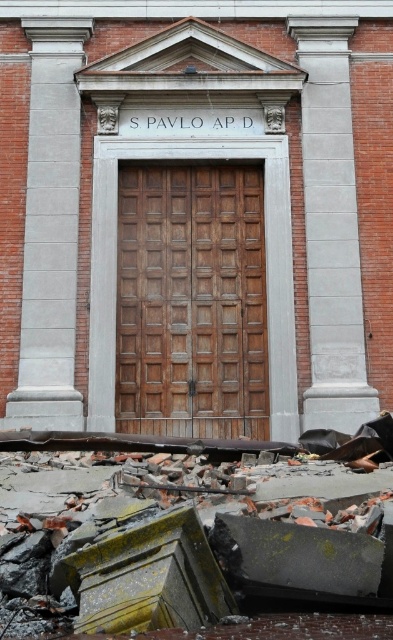
You are a delivery person trying to enter the building through the wooden panelled door at center. There is a gray concrete column at right nearby. Based on the scene, can you tell me whether the door is positioned lower than the column?

The wooden panelled door at center is below the gray concrete column at right, so yes, the door is positioned lower than the column.

You are standing at the entrance of the building and want to take a photo that includes both the gray concrete column at left and the gray concrete column at right. Which column should you position yourself closer to in order to capture both in the frame?

You should position yourself closer to the gray concrete column at left since it is to the left of the gray concrete column at right, allowing both columns to fit within the camera frame when centered.